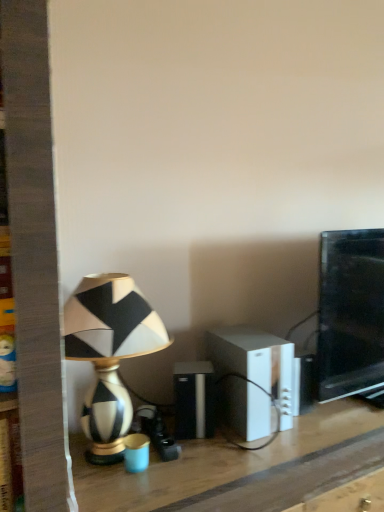
The height and width of the screenshot is (512, 384). Find the location of `black plastic speaker at center, the 2th speaker from the right`. black plastic speaker at center, the 2th speaker from the right is located at coordinates (194, 400).

What do you see at coordinates (109, 353) in the screenshot? This screenshot has height=512, width=384. I see `black and white ceramic lamp at left` at bounding box center [109, 353].

Find the location of `black glossy monitor at right`. black glossy monitor at right is located at coordinates (350, 313).

Does black and white ceramic lamp at left turn towards wooden table at center?

No, black and white ceramic lamp at left is not facing towards wooden table at center.

Is point (74, 313) closer or farther from the camera than point (223, 444)?

Point (74, 313) is positioned closer to the camera compared to point (223, 444).

Between black and white ceramic lamp at left and wooden table at center, which one has more height?

wooden table at center is taller.

Which object is further away from the camera taking this photo, black and white ceramic lamp at left or wooden table at center?

black and white ceramic lamp at left is further away from the camera.

This screenshot has height=512, width=384. I want to click on table below the black plastic speaker at center, the 2th speaker from the right (from the image's perspective), so click(x=242, y=467).

Who is shorter, black plastic speaker at center, which is the first speaker from left to right, or wooden table at center?

black plastic speaker at center, which is the first speaker from left to right, is shorter.

Can you confirm if black plastic speaker at center, which is the first speaker from left to right, is smaller than wooden table at center?

Indeed, black plastic speaker at center, which is the first speaker from left to right, has a smaller size compared to wooden table at center.

Which object is more forward, black plastic speaker at center, the 2th speaker from the right, or wooden table at center?

Positioned in front is wooden table at center.

From a real-world perspective, is black and white ceramic lamp at left physically below black glossy monitor at right?

Yes, from a real-world perspective, black and white ceramic lamp at left is below black glossy monitor at right.

From the image's perspective, would you say black and white ceramic lamp at left is positioned over black glossy monitor at right?

Incorrect, from the image's perspective, black and white ceramic lamp at left is lower than black glossy monitor at right.

Is black and white ceramic lamp at left positioned with its back to black glossy monitor at right?

black and white ceramic lamp at left does not have its back to black glossy monitor at right.

Between black and white ceramic lamp at left and white plastic speaker at center, acting as the first speaker starting from the right, which one is positioned in front?

black and white ceramic lamp at left is closer to the camera.

Do you think black and white ceramic lamp at left is within white plastic speaker at center, which is the 2th speaker from left to right, or outside of it?

black and white ceramic lamp at left is not inside white plastic speaker at center, which is the 2th speaker from left to right, it's outside.

Is point (80, 309) positioned in front of point (249, 367)?

Yes, point (80, 309) is in front of point (249, 367).

Which is more to the left, black and white ceramic lamp at left or white plastic speaker at center, acting as the first speaker starting from the right?

From the viewer's perspective, black and white ceramic lamp at left appears more on the left side.

Is black glossy monitor at right turned away from black and white ceramic lamp at left?

No, black and white ceramic lamp at left is not at the back of black glossy monitor at right.

Can you tell me how much black glossy monitor at right and black and white ceramic lamp at left differ in facing direction?

There is a 0.456-degree angle between the facing directions of black glossy monitor at right and black and white ceramic lamp at left.

Is point (373, 344) positioned in front of point (74, 294)?

That is False.

Are black glossy monitor at right and black and white ceramic lamp at left far apart?

That's not correct — black glossy monitor at right is a little close to black and white ceramic lamp at left.

Which point is more forward, (177, 426) or (253, 367)?

Positioned in front is point (253, 367).

Consider the image. Is black plastic speaker at center, the 2th speaker from the right, with white plastic speaker at center, acting as the first speaker starting from the right?

black plastic speaker at center, the 2th speaker from the right, and white plastic speaker at center, acting as the first speaker starting from the right, are not in contact.

Is black plastic speaker at center, the 2th speaker from the right, oriented away from white plastic speaker at center, which is the 2th speaker from left to right?

Yes, black plastic speaker at center, the 2th speaker from the right, is facing away from white plastic speaker at center, which is the 2th speaker from left to right.

Which object is thinner, black plastic speaker at center, the 2th speaker from the right, or black and white ceramic lamp at left?

black plastic speaker at center, the 2th speaker from the right, is thinner.

Is black plastic speaker at center, the 2th speaker from the right, looking in the opposite direction of black and white ceramic lamp at left?

black plastic speaker at center, the 2th speaker from the right, is not turned away from black and white ceramic lamp at left.

Which object is further away from the camera, black plastic speaker at center, the 2th speaker from the right, or black and white ceramic lamp at left?

Positioned behind is black plastic speaker at center, the 2th speaker from the right.

Considering the points (206, 426) and (144, 301), which point is in front, point (206, 426) or point (144, 301)?

The point (206, 426) is in front.

What are the coordinates of `lamp behind the wooden table at center` in the screenshot? It's located at (109, 353).

Locate an element on the screen. This screenshot has width=384, height=512. the 2nd speaker to the left of the wooden table at center, counting from the anchor's position is located at coordinates (194, 400).

Looking at the image, which one is located closer to black plastic speaker at center, the 2th speaker from the right, wooden table at center or white plastic speaker at center, acting as the first speaker starting from the right?

white plastic speaker at center, acting as the first speaker starting from the right, is positioned closer to the anchor black plastic speaker at center, the 2th speaker from the right.

Estimate the real-world distances between objects in this image. Which object is closer to white plastic speaker at center, which is the 2th speaker from left to right, black glossy monitor at right or wooden table at center?

wooden table at center.

From the image, which object appears to be farther from white plastic speaker at center, acting as the first speaker starting from the right, black glossy monitor at right or black plastic speaker at center, which is the first speaker from left to right?

black glossy monitor at right is further to white plastic speaker at center, acting as the first speaker starting from the right.

Which object lies nearer to the anchor point black plastic speaker at center, the 2th speaker from the right, black and white ceramic lamp at left or black glossy monitor at right?

black and white ceramic lamp at left lies closer to black plastic speaker at center, the 2th speaker from the right, than the other object.

Consider the image. Based on their spatial positions, is black plastic speaker at center, which is the first speaker from left to right, or black and white ceramic lamp at left further from white plastic speaker at center, which is the 2th speaker from left to right?

black and white ceramic lamp at left is further to white plastic speaker at center, which is the 2th speaker from left to right.

Based on their spatial positions, is black and white ceramic lamp at left or black glossy monitor at right closer to white plastic speaker at center, acting as the first speaker starting from the right?

black glossy monitor at right is positioned closer to the anchor white plastic speaker at center, acting as the first speaker starting from the right.

Considering their positions, is white plastic speaker at center, acting as the first speaker starting from the right, positioned further to black glossy monitor at right than black plastic speaker at center, the 2th speaker from the right?

black plastic speaker at center, the 2th speaker from the right, lies further to black glossy monitor at right than the other object.

Considering their positions, is black plastic speaker at center, the 2th speaker from the right, positioned closer to black glossy monitor at right than black and white ceramic lamp at left?

The object closer to black glossy monitor at right is black plastic speaker at center, the 2th speaker from the right.

Locate an element on the screen. table located between black and white ceramic lamp at left and black glossy monitor at right in the left-right direction is located at coordinates (242, 467).

Image resolution: width=384 pixels, height=512 pixels. In order to click on speaker between white plastic speaker at center, acting as the first speaker starting from the right, and wooden table at center from top to bottom in this screenshot , I will do `click(194, 400)`.

Locate an element on the screen. speaker situated between black and white ceramic lamp at left and white plastic speaker at center, acting as the first speaker starting from the right, from left to right is located at coordinates pos(194,400).

Identify the location of speaker located between black plastic speaker at center, the 2th speaker from the right, and black glossy monitor at right in the left-right direction. (253, 378).